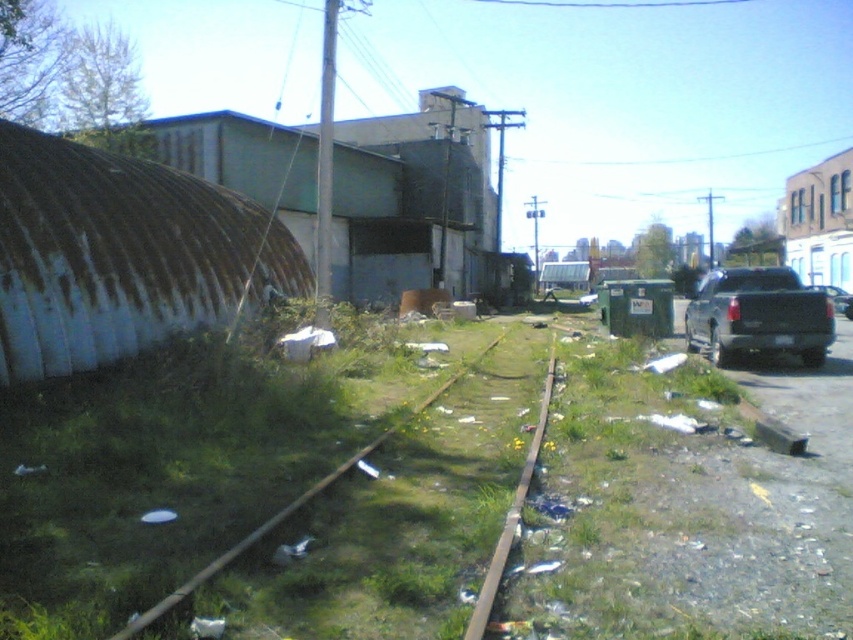
Question: Which point is closer to the camera taking this photo?

Choices:
 (A) [x=784, y=349]
 (B) [x=233, y=560]

Answer: (B)

Question: Which point is farther to the camera?

Choices:
 (A) green grass train track at center
 (B) metallic gray truck at right
 (C) black matte truck at right
 (D) green grassy train track at center

Answer: (C)

Question: Which of the following is the closest to the observer?

Choices:
 (A) green grass train track at center
 (B) black matte truck at right
 (C) green grassy train track at center

Answer: (C)

Question: Is green grass train track at center closer to camera compared to green grassy train track at center?

Choices:
 (A) yes
 (B) no

Answer: (B)

Question: Can you confirm if black matte truck at right is thinner than metallic gray truck at right?

Choices:
 (A) yes
 (B) no

Answer: (B)

Question: Does green grass train track at center have a smaller size compared to green grassy train track at center?

Choices:
 (A) yes
 (B) no

Answer: (B)